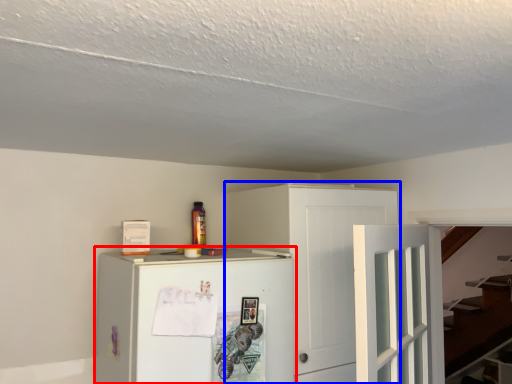
Question: Which object appears farthest to the camera in this image, refrigerator (highlighted by a red box) or cabinetry (highlighted by a blue box)?

Choices:
 (A) refrigerator
 (B) cabinetry

Answer: (B)